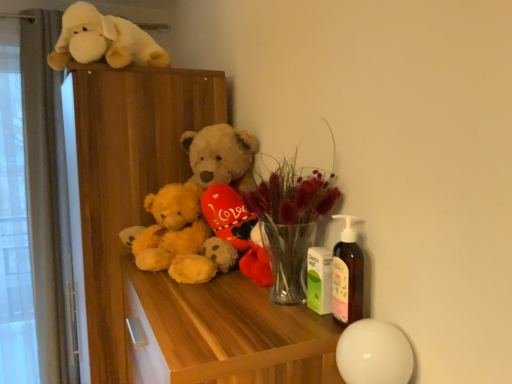
Identify the location of vacant space that is to the left of translucent glass vase at center. The image size is (512, 384). (210, 316).